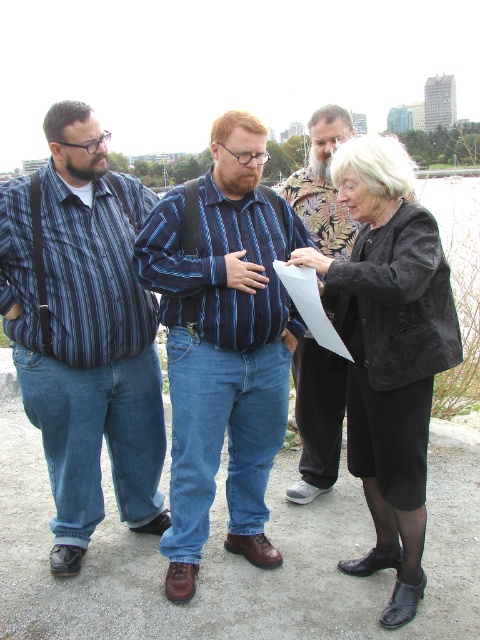
Measure the distance between black suede jacket at center and white paper at center.

The distance of black suede jacket at center from white paper at center is 12.70 inches.

Is black suede jacket at center positioned before white paper at center?

That is True.

Find the location of a particular element. black suede jacket at center is located at coordinates (388, 349).

The image size is (480, 640). In order to click on black suede jacket at center in this screenshot , I will do `click(388, 349)`.

Is point (343, 141) positioned in front of point (321, 320)?

That is False.

Is point (303, 451) more distant than point (278, 260)?

Yes, point (303, 451) is behind point (278, 260).

Is point (334, 362) farther from camera compared to point (336, 348)?

That is True.

I want to click on striped cotton shirt at center, so click(x=316, y=419).

Does blue striped shirt at center have a smaller size compared to striped cotton shirt at center?

Yes.

Which is behind, point (169, 308) or point (300, 461)?

Positioned behind is point (300, 461).

Which is in front, point (222, 145) or point (347, 128)?

Point (222, 145)

Image resolution: width=480 pixels, height=640 pixels. I want to click on blue striped shirt at center, so [x=223, y=344].